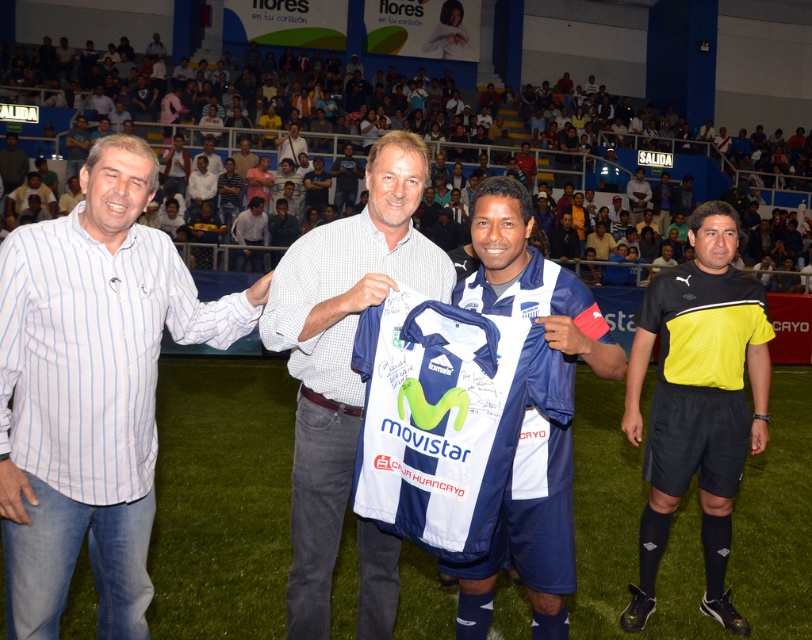
Is white striped shirt at left taller than white checkered shirt at center?

Incorrect, white striped shirt at left's height is not larger of white checkered shirt at center's.

Which of these two, white striped shirt at left or white checkered shirt at center, stands taller?

white checkered shirt at center is taller.

What do you see at coordinates (91, 390) in the screenshot? The image size is (812, 640). I see `white striped shirt at left` at bounding box center [91, 390].

Locate an element on the screen. This screenshot has height=640, width=812. white striped shirt at left is located at coordinates (91, 390).

Which is more to the right, white checkered shirt at center or white fabric jersey at center?

From the viewer's perspective, white fabric jersey at center appears more on the right side.

Does white checkered shirt at center appear on the right side of white fabric jersey at center?

Incorrect, white checkered shirt at center is not on the right side of white fabric jersey at center.

Is point (340, 449) farther from camera compared to point (508, 228)?

Yes, point (340, 449) is farther from viewer.

Image resolution: width=812 pixels, height=640 pixels. I want to click on white checkered shirt at center, so click(x=340, y=353).

Is white checkered shirt at center further to camera compared to white jersey at center?

That is False.

Is point (359, 570) closer to camera compared to point (374, 259)?

No, it is not.

What do you see at coordinates (340, 353) in the screenshot? The width and height of the screenshot is (812, 640). I see `white checkered shirt at center` at bounding box center [340, 353].

In order to click on white checkered shirt at center in this screenshot , I will do `click(340, 353)`.